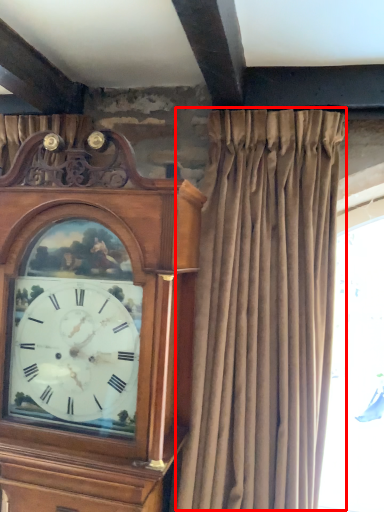
Question: Where is curtain (annotated by the red box) located in relation to clock in the image?

Choices:
 (A) left
 (B) right

Answer: (B)